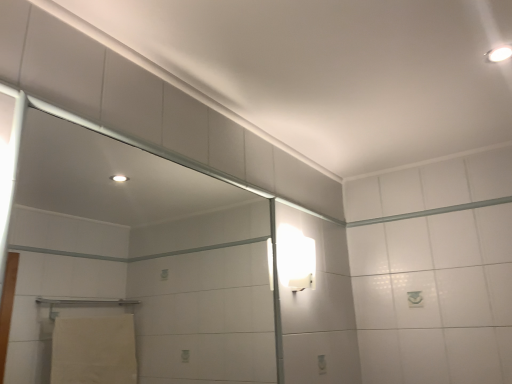
Question: From a real-world perspective, is white glossy light fixture at upper right, the second light fixture from the bottom, under white glossy wall sconce at upper right, which is counted as the 2th light fixture, starting from the front?

Choices:
 (A) no
 (B) yes

Answer: (A)

Question: Considering the relative sizes of white glossy light fixture at upper right, the second light fixture from the bottom, and white glossy wall sconce at upper right, which is counted as the second light fixture, starting from the right, in the image provided, is white glossy light fixture at upper right, the second light fixture from the bottom, taller than white glossy wall sconce at upper right, which is counted as the second light fixture, starting from the right,?

Choices:
 (A) no
 (B) yes

Answer: (A)

Question: From the image's perspective, is white glossy light fixture at upper right, the second light fixture from the bottom, beneath white glossy wall sconce at upper right, arranged as the second light fixture when viewed from the top?

Choices:
 (A) no
 (B) yes

Answer: (A)

Question: Is the depth of white glossy light fixture at upper right, the 1th light fixture viewed from the right, greater than that of white glossy wall sconce at upper right, the 1th light fixture positioned from the back?

Choices:
 (A) yes
 (B) no

Answer: (B)

Question: Is white glossy light fixture at upper right, which is the first light fixture from front to back, in contact with white glossy wall sconce at upper right, the 1th light fixture positioned from the back?

Choices:
 (A) yes
 (B) no

Answer: (B)

Question: Would you say white glossy light fixture at upper right, which is the first light fixture from front to back, is outside white glossy wall sconce at upper right, which is the 1th light fixture from left to right?

Choices:
 (A) no
 (B) yes

Answer: (B)

Question: Considering the relative sizes of transparent glass screen door at upper left and white glossy light fixture at upper right, which is the first light fixture from front to back, in the image provided, is transparent glass screen door at upper left wider than white glossy light fixture at upper right, which is the first light fixture from front to back,?

Choices:
 (A) no
 (B) yes

Answer: (A)

Question: Does transparent glass screen door at upper left appear on the left side of white glossy light fixture at upper right, the first light fixture positioned from the top?

Choices:
 (A) yes
 (B) no

Answer: (A)

Question: Is the depth of transparent glass screen door at upper left greater than that of white glossy light fixture at upper right, the 1th light fixture viewed from the right?

Choices:
 (A) yes
 (B) no

Answer: (B)

Question: From the image's perspective, would you say transparent glass screen door at upper left is positioned over white glossy light fixture at upper right, which is the first light fixture from front to back?

Choices:
 (A) yes
 (B) no

Answer: (B)

Question: From the image's perspective, is transparent glass screen door at upper left below white glossy light fixture at upper right, which is the first light fixture from front to back?

Choices:
 (A) yes
 (B) no

Answer: (A)

Question: Can you confirm if transparent glass screen door at upper left is smaller than white glossy light fixture at upper right, the second light fixture from the bottom?

Choices:
 (A) yes
 (B) no

Answer: (B)

Question: Considering the relative positions of white glossy wall sconce at upper right, which is counted as the 2th light fixture, starting from the front, and transparent glass screen door at upper left in the image provided, is white glossy wall sconce at upper right, which is counted as the 2th light fixture, starting from the front, behind transparent glass screen door at upper left?

Choices:
 (A) yes
 (B) no

Answer: (A)